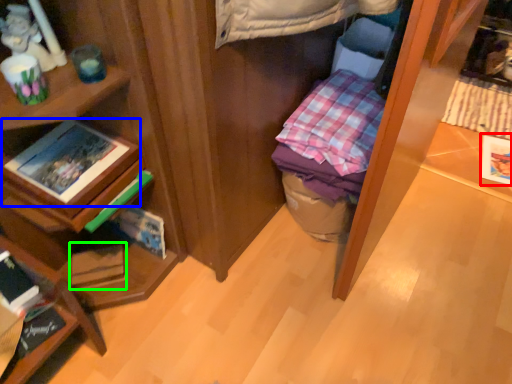
Question: Estimate the real-world distances between objects in this image. Which object is farther from paperback book (highlighted by a red box), book (highlighted by a blue box) or paperback book (highlighted by a green box)?

Choices:
 (A) book
 (B) paperback book

Answer: (A)